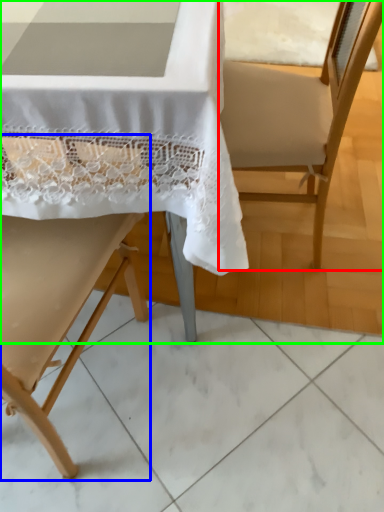
Question: Estimate the real-world distances between objects in this image. Which object is closer to armchair (highlighted by a red box), chair (highlighted by a blue box) or chair (highlighted by a green box)?

Choices:
 (A) chair
 (B) chair

Answer: (B)